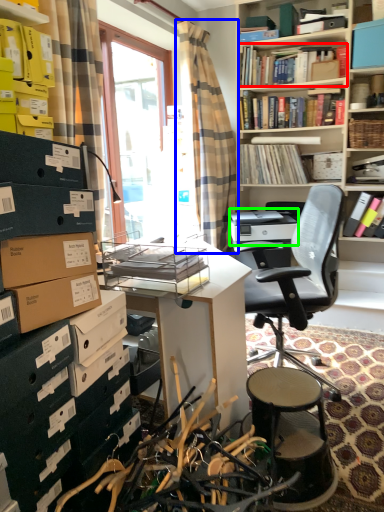
Question: Estimate the real-world distances between objects in this image. Which object is farther from book (highlighted by a red box), curtain (highlighted by a blue box) or printer (highlighted by a green box)?

Choices:
 (A) curtain
 (B) printer

Answer: (B)